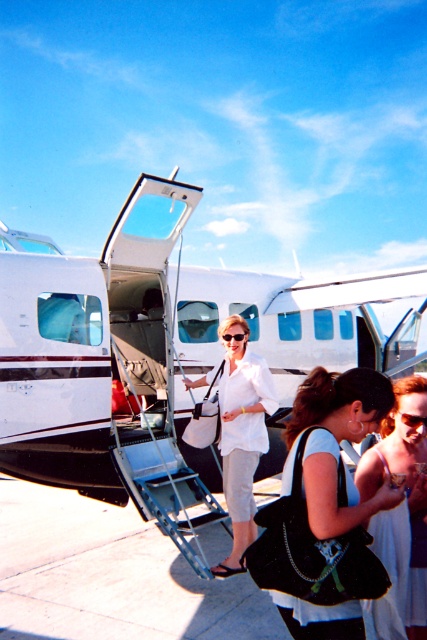
Question: Does white matte airplane at center appear on the left side of velvet black purse at center?

Choices:
 (A) no
 (B) yes

Answer: (B)

Question: Does concrete tarmac at lower center come behind white fabric dress at center?

Choices:
 (A) no
 (B) yes

Answer: (B)

Question: Is white matte airplane at center thinner than concrete tarmac at lower center?

Choices:
 (A) yes
 (B) no

Answer: (A)

Question: Estimate the real-world distances between objects in this image. Which object is farther from the white fabric dress at center?

Choices:
 (A) white matte skirt at center
 (B) velvet black purse at center
 (C) white matte airplane at center

Answer: (C)

Question: Among these points, which one is nearest to the camera?

Choices:
 (A) pos(67,618)
 (B) pos(327,618)
 (C) pos(96,387)
 (D) pos(394,548)

Answer: (B)

Question: Which of the following is the closest to the observer?

Choices:
 (A) (388, 627)
 (B) (160, 269)
 (C) (50, 588)

Answer: (A)